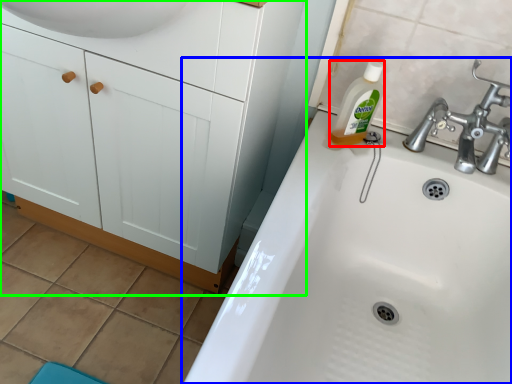
Question: Which object is the farthest from cleaning product (highlighted by a red box)? Choose among these: sink (highlighted by a blue box) or bathroom cabinet (highlighted by a green box).

Choices:
 (A) sink
 (B) bathroom cabinet

Answer: (B)